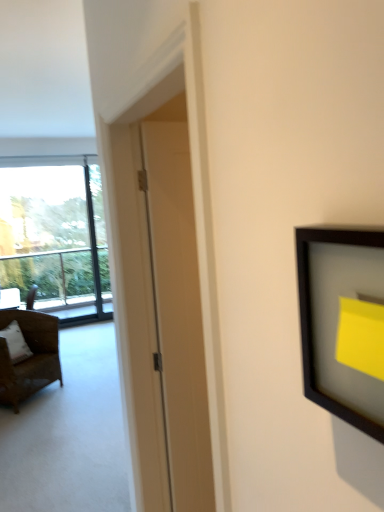
Question: Does transparent glass window at left have a smaller size compared to white matte door at center?

Choices:
 (A) yes
 (B) no

Answer: (B)

Question: Is transparent glass window at left outside white matte door at center?

Choices:
 (A) no
 (B) yes

Answer: (B)

Question: From a real-world perspective, is transparent glass window at left located beneath white matte door at center?

Choices:
 (A) yes
 (B) no

Answer: (B)

Question: Is transparent glass window at left far away from white matte door at center?

Choices:
 (A) yes
 (B) no

Answer: (A)

Question: Is transparent glass window at left positioned behind white matte door at center?

Choices:
 (A) yes
 (B) no

Answer: (A)

Question: Can you confirm if transparent glass window at left is thinner than white matte door at center?

Choices:
 (A) no
 (B) yes

Answer: (A)

Question: From a real-world perspective, is white fabric pillow at left beneath transparent glass window at left?

Choices:
 (A) no
 (B) yes

Answer: (B)

Question: Does white fabric pillow at left appear on the right side of transparent glass window at left?

Choices:
 (A) no
 (B) yes

Answer: (B)

Question: From a real-world perspective, is white fabric pillow at left positioned over transparent glass window at left based on gravity?

Choices:
 (A) no
 (B) yes

Answer: (A)

Question: From the image's perspective, is white fabric pillow at left beneath transparent glass window at left?

Choices:
 (A) no
 (B) yes

Answer: (B)

Question: Considering the relative sizes of white fabric pillow at left and transparent glass window at left in the image provided, is white fabric pillow at left shorter than transparent glass window at left?

Choices:
 (A) yes
 (B) no

Answer: (A)

Question: Does white fabric pillow at left have a larger size compared to transparent glass window at left?

Choices:
 (A) yes
 (B) no

Answer: (B)

Question: Is white fabric pillow at left at the back of white matte door at center?

Choices:
 (A) yes
 (B) no

Answer: (B)